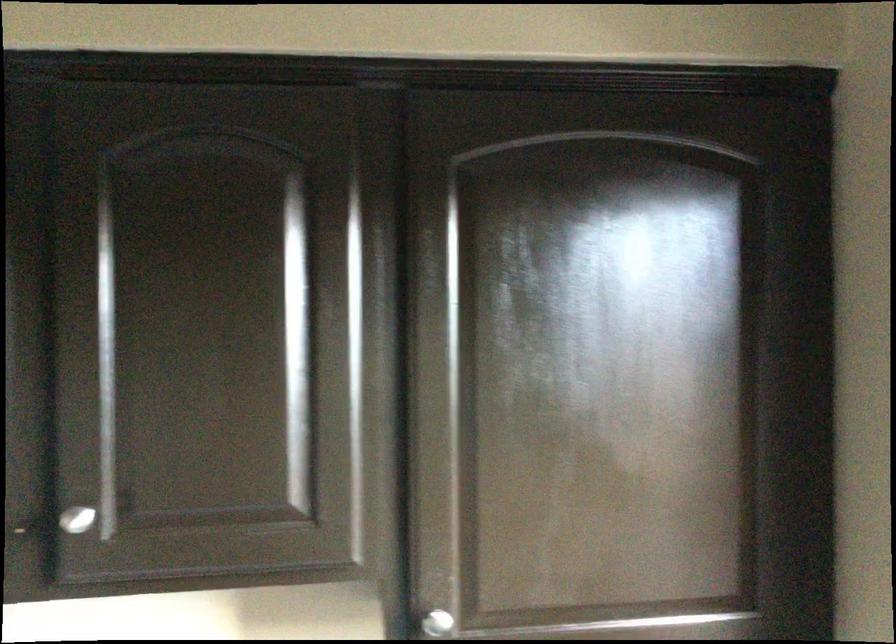
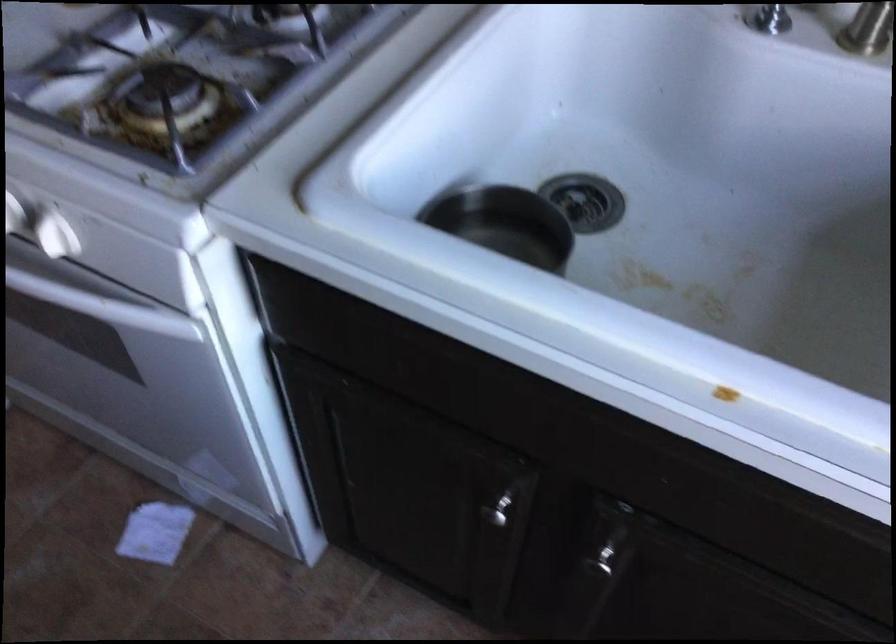
The first image is from the beginning of the video and the second image is from the end. How did the camera likely rotate when shooting the video?

The camera's rotation is toward left-down.